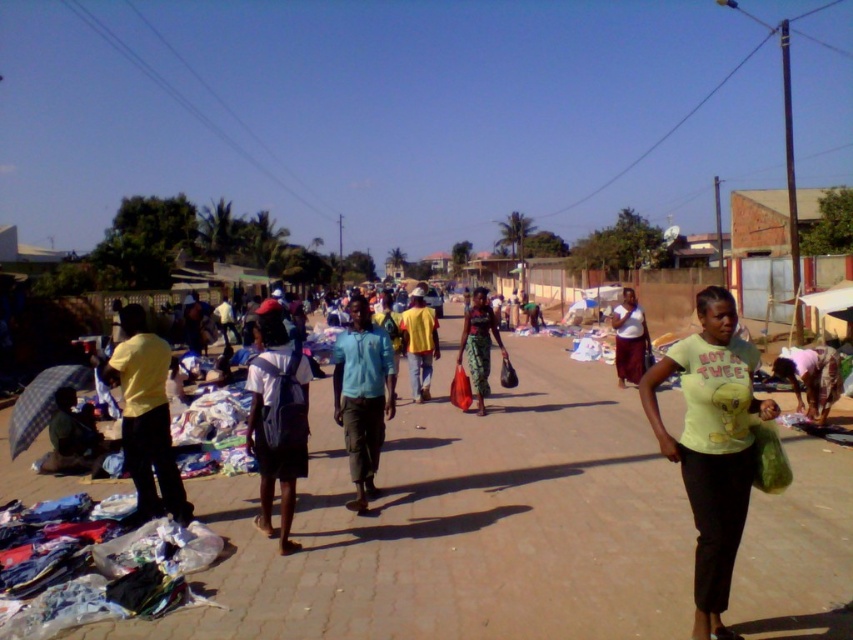
Is point (265, 513) closer to camera compared to point (479, 292)?

Yes, it is in front of point (479, 292).

This screenshot has width=853, height=640. I want to click on white matte backpack at center, so click(x=279, y=419).

Does point (276, 353) come in front of point (480, 406)?

Yes, point (276, 353) is closer to viewer.

I want to click on white matte backpack at center, so click(x=279, y=419).

Which is more to the left, yellow matte t-shirt at center-right or matte green skirt at center?

matte green skirt at center

Does yellow matte t-shirt at center-right have a larger size compared to matte green skirt at center?

Incorrect, yellow matte t-shirt at center-right is not larger than matte green skirt at center.

Is point (741, 529) positioned behind point (485, 310)?

No, (741, 529) is closer to viewer.

Where is `yellow matte t-shirt at center-right`? Image resolution: width=853 pixels, height=640 pixels. yellow matte t-shirt at center-right is located at coordinates (711, 445).

Who is shorter, yellow matte t-shirt at center-right or matte white shirt at center?

With less height is matte white shirt at center.

Is point (660, 365) positioned behind point (640, 324)?

No, (660, 365) is closer to viewer.

Locate an element on the screen. This screenshot has height=640, width=853. yellow matte t-shirt at center-right is located at coordinates (711, 445).